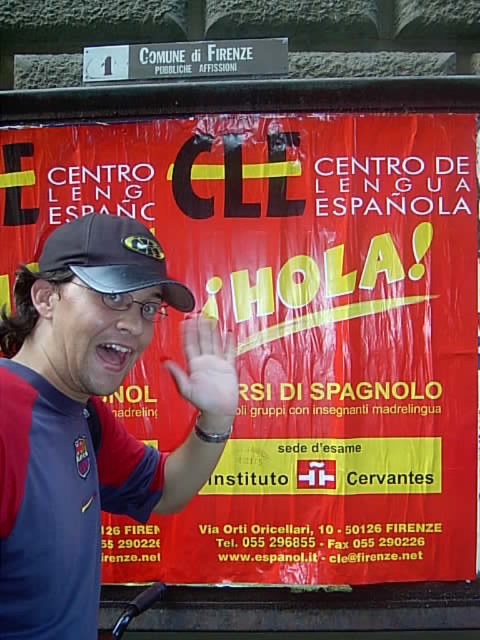
You are looking at the poster and want to touch the dark blue jersey at center. What are the coordinates where you should aim your finger?

The dark blue jersey at center is located at point (91, 417).

You are a soccer player who just arrived at the field and see the dark blue jersey at center and the matte black cap at center. Which item should you pick up first if you need to wear both before the game starts?

The dark blue jersey at center is bigger than the matte black cap at center, so you should pick up the dark blue jersey at center first to put it on before the smaller matte black cap.